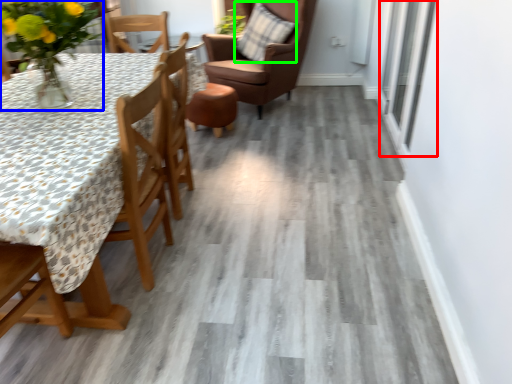
Question: Estimate the real-world distances between objects in this image. Which object is closer to window (highlighted by a red box), floral arrangement (highlighted by a blue box) or pillow (highlighted by a green box)?

Choices:
 (A) floral arrangement
 (B) pillow

Answer: (B)